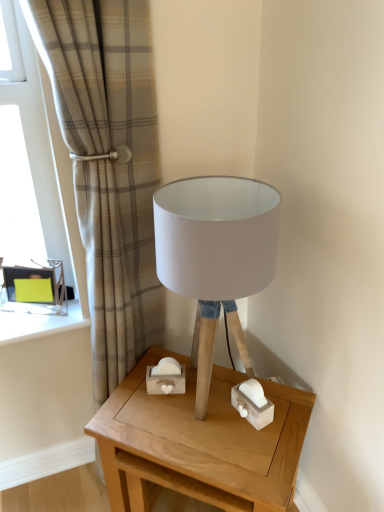
I want to click on free region under white fabric lampshade at center (from a real-world perspective), so click(x=220, y=392).